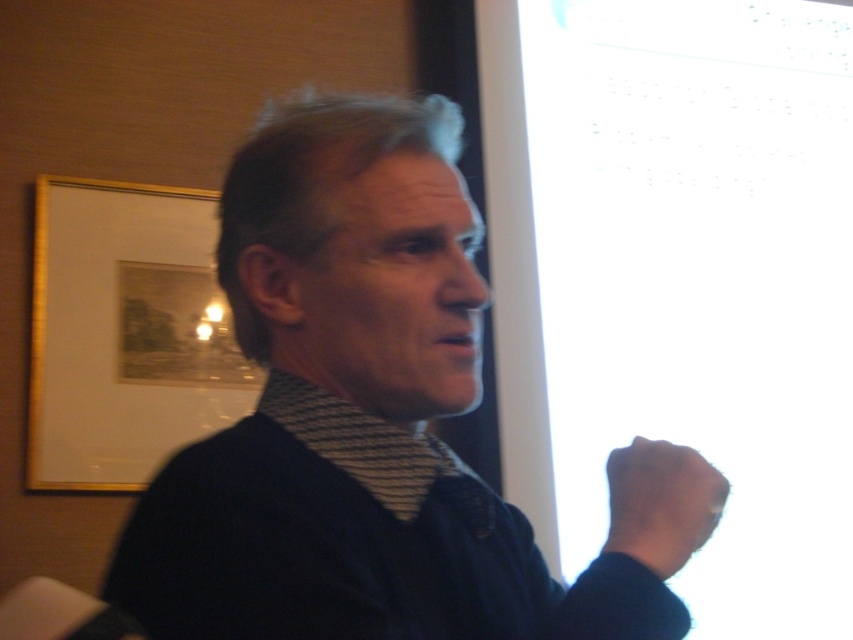
Between gold framed picture at left and black matte hand at lower right, which one appears on the right side from the viewer's perspective?

black matte hand at lower right

Is point (85, 301) farther from viewer compared to point (643, 515)?

Yes.

Find the location of `gold framed picture at left`. gold framed picture at left is located at coordinates (125, 333).

Is point (234, 442) less distant than point (651, 550)?

No, (234, 442) is behind (651, 550).

Can you confirm if dark blue sweater at center is thinner than black matte hand at lower right?

No, dark blue sweater at center is not thinner than black matte hand at lower right.

Which is behind, point (148, 568) or point (701, 525)?

Point (701, 525)

Find the location of a particular element. This screenshot has width=853, height=640. dark blue sweater at center is located at coordinates (355, 417).

This screenshot has height=640, width=853. What do you see at coordinates (355, 417) in the screenshot? I see `dark blue sweater at center` at bounding box center [355, 417].

Is dark blue sweater at center positioned before gold framed picture at left?

Yes, dark blue sweater at center is in front of gold framed picture at left.

Is point (337, 451) farther from viewer compared to point (84, 221)?

No, (337, 451) is in front of (84, 221).

This screenshot has width=853, height=640. In order to click on dark blue sweater at center in this screenshot , I will do `click(355, 417)`.